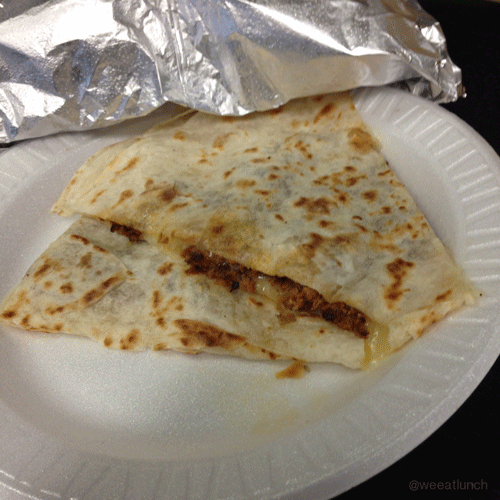
You are a GUI agent. You are given a task and a screenshot of the screen. Output one action in this format:
    pyautogui.click(x=<x>, y=<y>)
    Task: Click on the plate
    Image resolution: width=500 pixels, height=500 pixels.
    Given the screenshot: What is the action you would take?
    point(177,415)